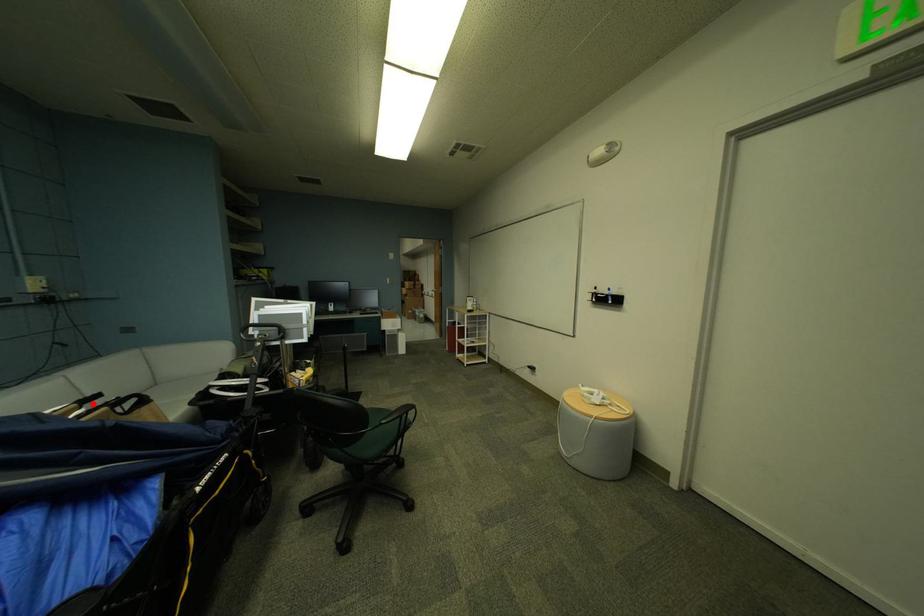
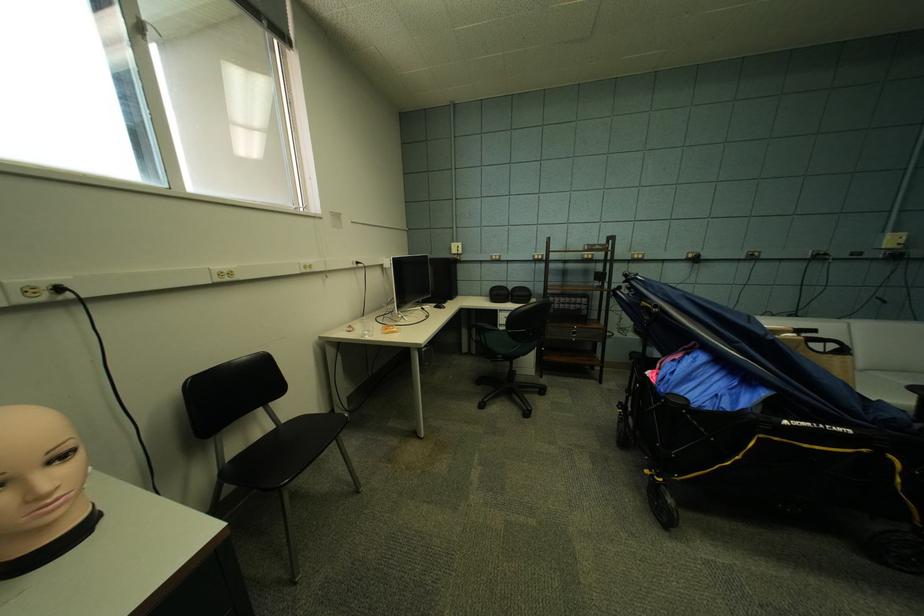
Find the pixel in the second image that matches the highlighted location in the first image.

(808, 331)